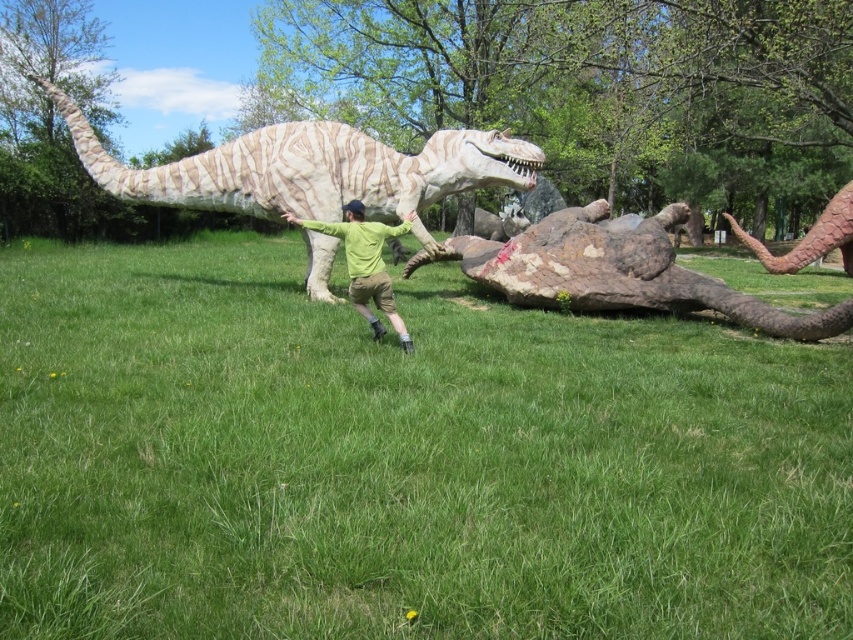
You are standing at the point marked as point (401, 460) in the image. What is the immediate surface beneath your feet?

The immediate surface beneath your feet at point (401, 460) is green grass at center.